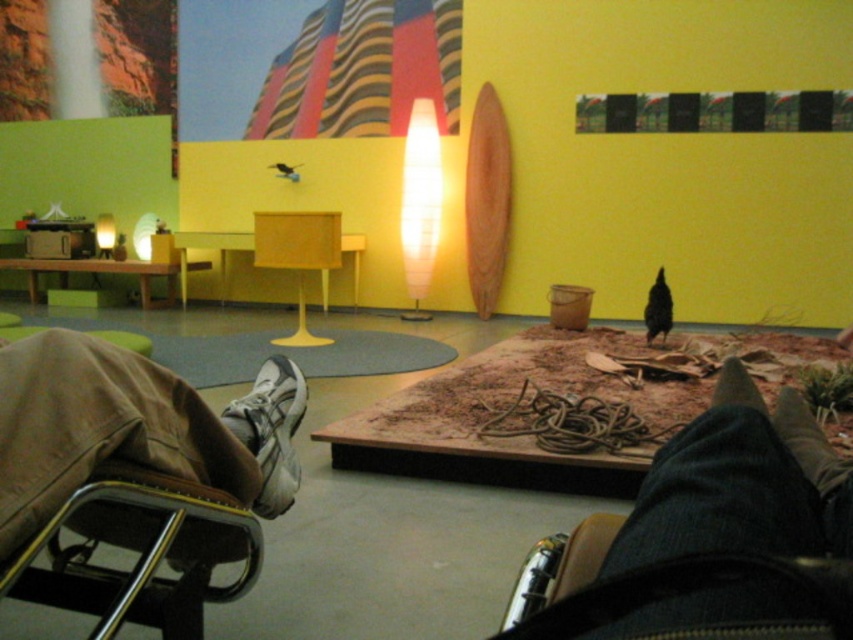
You are a visitor at the art gallery and want to sit down. You see the metallic silver folding chair at lower left and the white mesh shoe at lower left. Which one is taller?

The metallic silver folding chair at lower left is taller than the white mesh shoe at lower left.

You are standing in the art gallery and want to place a small sculpture exactly halfway between the two points labeled point (x=178, y=403) and point (x=283, y=481). Will this placement ensure the sculpture is closer to the yellow wall compared to the mural wall?

Yes, because point (x=178, y=403) is in front of point (x=283, y=481), so the halfway point between them would still be closer to the yellow wall than the mural wall.

You are standing at the entrance of the art gallery and see the metallic silver folding chair at lower left and the white mesh shoe at lower left. Which object is closer to you?

The metallic silver folding chair at lower left is closer to you because it is in front of the white mesh shoe at lower left.